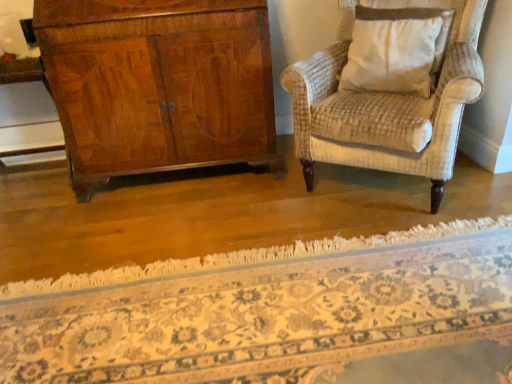
Question: Is floral carpet at center in front of or behind beige textured pillow at upper right in the image?

Choices:
 (A) front
 (B) behind

Answer: (A)

Question: Considering the relative positions of floral carpet at center and beige textured pillow at upper right in the image provided, is floral carpet at center to the left or to the right of beige textured pillow at upper right?

Choices:
 (A) left
 (B) right

Answer: (A)

Question: Is floral carpet at center bigger or smaller than beige textured pillow at upper right?

Choices:
 (A) big
 (B) small

Answer: (A)

Question: Considering their positions, is beige textured pillow at upper right located in front of or behind floral carpet at center?

Choices:
 (A) front
 (B) behind

Answer: (B)

Question: From their relative heights in the image, would you say beige textured pillow at upper right is taller or shorter than floral carpet at center?

Choices:
 (A) tall
 (B) short

Answer: (A)

Question: From the image's perspective, is beige textured pillow at upper right positioned above or below floral carpet at center?

Choices:
 (A) below
 (B) above

Answer: (B)

Question: Considering the positions of point (416, 56) and point (186, 342), is point (416, 56) closer or farther from the camera than point (186, 342)?

Choices:
 (A) farther
 (B) closer

Answer: (A)